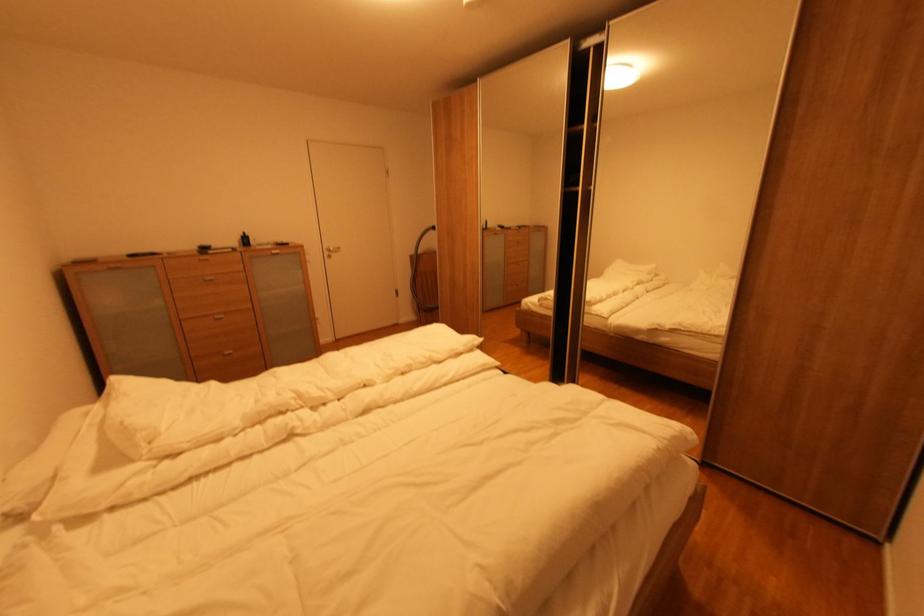
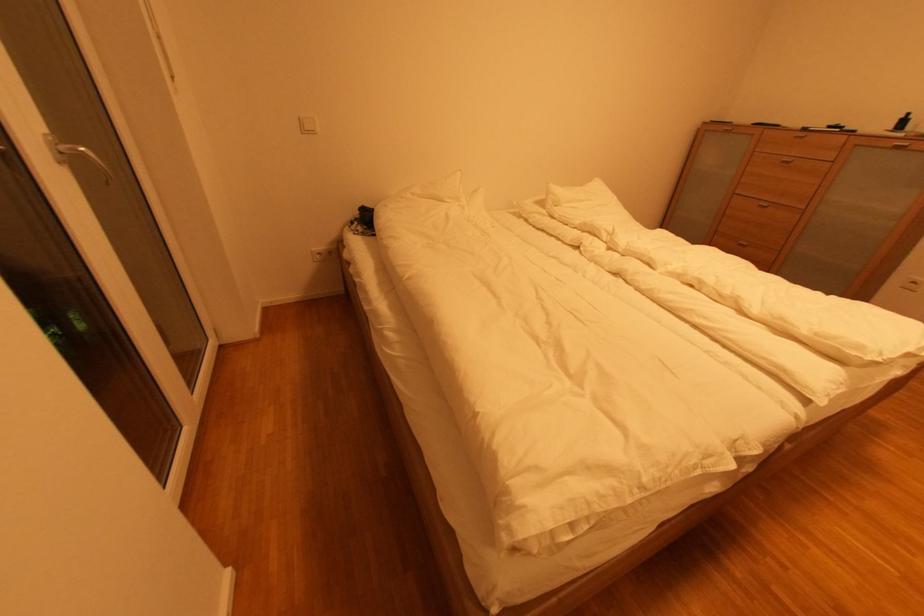
In the second image, find the point that corresponds to the point at 248,237 in the first image.

(908, 118)